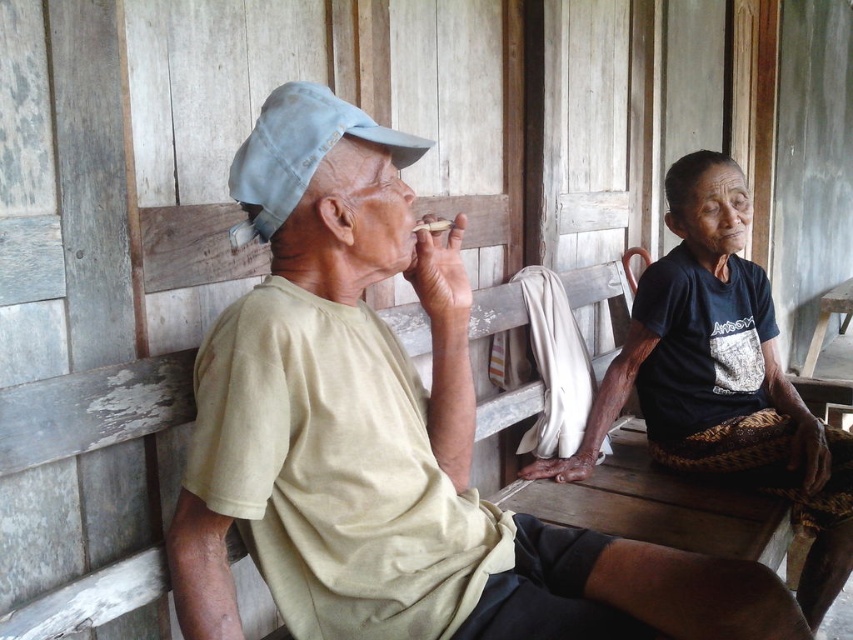
Is beige cotton shirt at left above dark blue fabric shirt at center?

Correct, beige cotton shirt at left is located above dark blue fabric shirt at center.

Find the location of a particular element. This screenshot has height=640, width=853. beige cotton shirt at left is located at coordinates (389, 436).